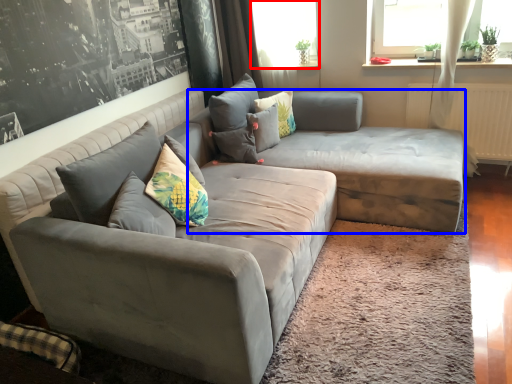
Question: Which object appears farthest to the camera in this image, window screen (highlighted by a red box) or couch (highlighted by a blue box)?

Choices:
 (A) window screen
 (B) couch

Answer: (A)